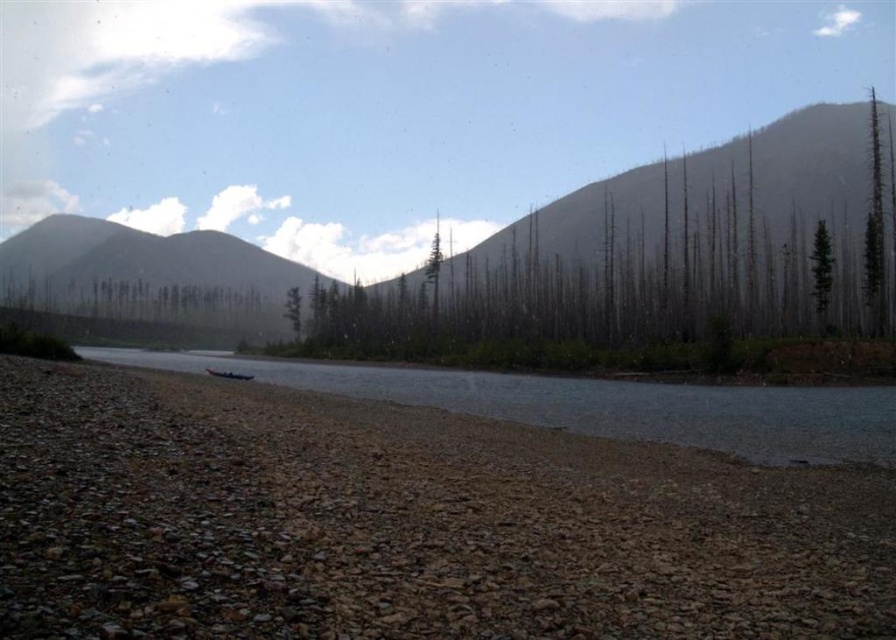
You are a hiker standing at the edge of the pebbled riverbank in the scene. You want to cross the river to the other side. The clear water at center is part of the river. If your average walking pace is 1.5 meters per second, how long will it take you to walk straight across the river to reach the opposite bank?

The clear water at center is 58.24 meters away from the camera. Assuming the river is approximately this width, it would take about 38.83 seconds to cross at 1.5 meters per second.

You are planning to cross the river using the blue plastic boat at lower center. You notice the gray rocky mountain at left in the distance. Which object is wider from your current viewpoint?

The gray rocky mountain at left is wider than the blue plastic boat at lower center according to the description.